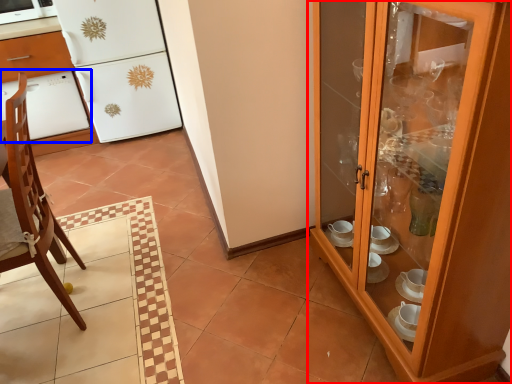
Question: Which of the following is the closest to the observer, cupboard (highlighted by a red box) or oven (highlighted by a blue box)?

Choices:
 (A) cupboard
 (B) oven

Answer: (A)